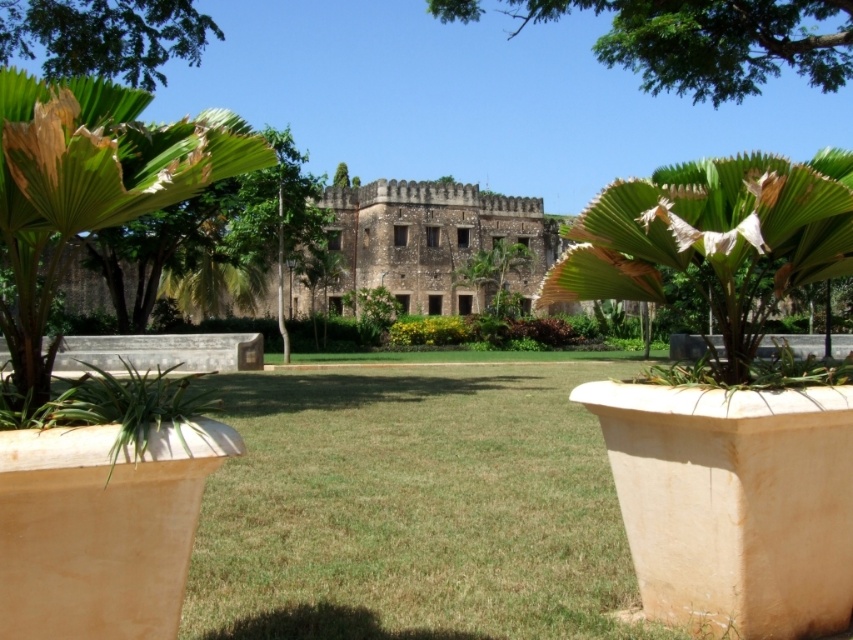
Question: Observing the image, what is the correct spatial positioning of green leafy palm at left in reference to green leafy tree at upper left?

Choices:
 (A) left
 (B) right

Answer: (A)

Question: Does green leafy palm at center appear on the right side of green leafy tree at upper left?

Choices:
 (A) yes
 (B) no

Answer: (A)

Question: Which object is farther from the camera taking this photo?

Choices:
 (A) green leafy tree at upper center
 (B) green leafy palm at center
 (C) green leafy palm at left
 (D) green leafy tree at upper left

Answer: (A)

Question: Based on their relative distances, which object is nearer to the green leafy tree at upper center?

Choices:
 (A) green leafy palm at left
 (B) green leafy palm at center

Answer: (B)

Question: Which object is farther from the camera taking this photo?

Choices:
 (A) green leafy palm at left
 (B) green leafy tree at upper left
 (C) green leafy palm at center
 (D) green leafy tree at upper center

Answer: (D)

Question: Is green leafy palm at center below green leafy tree at upper left?

Choices:
 (A) yes
 (B) no

Answer: (A)